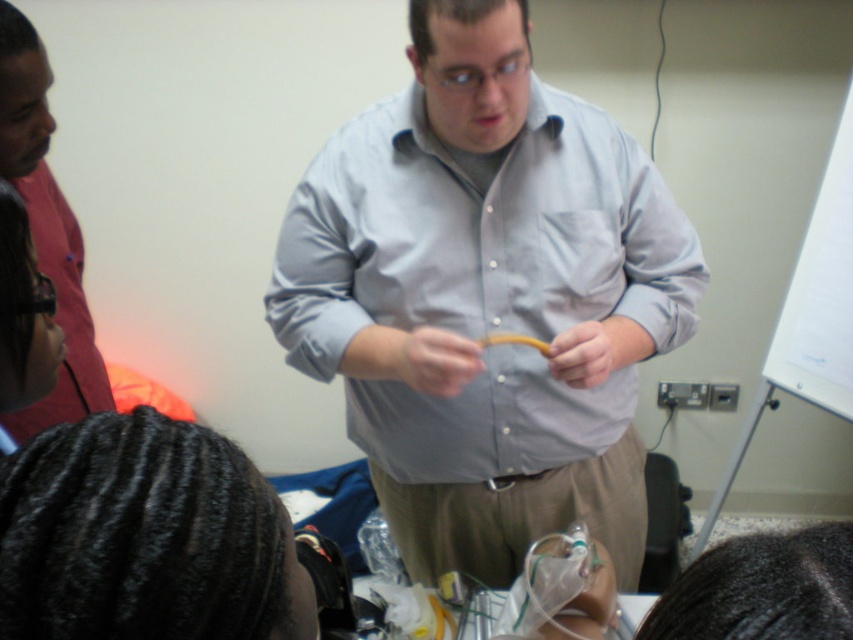
Based on the scene description, which object is positioned to the right of the other? The clear plastic tube at center or the yellow rubber tube at center?

The clear plastic tube at center is to the right of the yellow rubber tube at center.

You are a participant in the discussion and need to hand the presenter a document. Which object, the matte yellow pen at center or the matte yellow ring at center, is easier to reach if you extend your arm forward without moving your chair?

The matte yellow pen at center is closer to the viewer than the matte yellow ring at center, so it would be easier to reach by extending your arm forward without moving your chair.